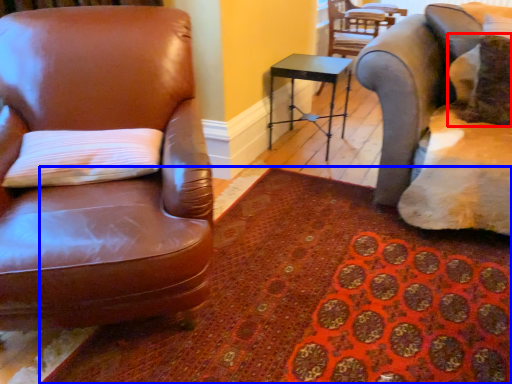
Question: Which object is closer to the camera taking this photo, pillow (highlighted by a red box) or mat (highlighted by a blue box)?

Choices:
 (A) pillow
 (B) mat

Answer: (B)